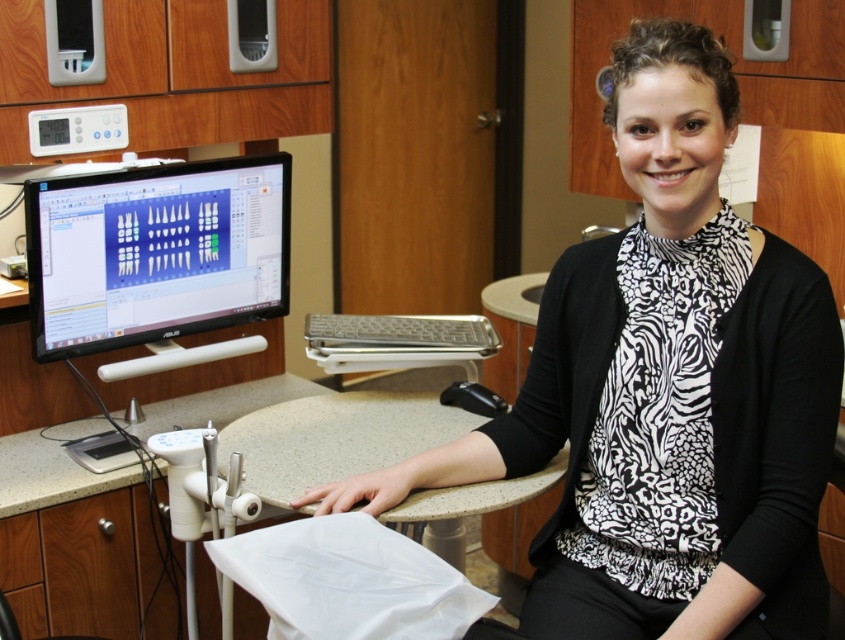
You are a patient entering the dental office and looking at the desk. Which object, the black printed blouse at center or the matte black monitor at center, is closer to you?

The black printed blouse at center is closer to the viewer than the matte black monitor at center.

Consider the image. You are a visitor in the dental office and want to place a small note on the desk. The note is 10 cm in height. Can you fit it on the white laminate counter at lower center without overlapping the black printed blouse at center?

The black printed blouse at center is much taller than the white laminate counter at lower center. Since the counter is shorter, the 10 cm tall note may not fit properly as the counter might not have enough vertical space. Consider placing it elsewhere.